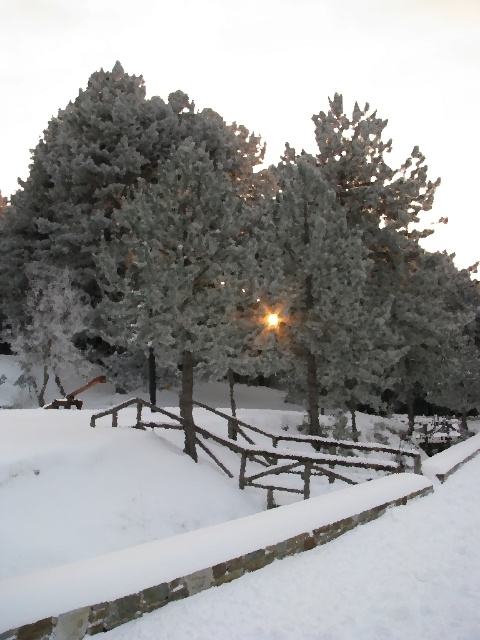
Question: Estimate the real-world distances between objects in this image. Which object is closer to the brown wooden fence at center?

Choices:
 (A) frosted snow-covered tree at upper left
 (B) white fluffy snow at center
 (C) frosted white tree at center

Answer: (B)

Question: Does white fluffy snow at center have a larger size compared to brown wooden fence at center?

Choices:
 (A) yes
 (B) no

Answer: (A)

Question: Which point is farther to the camera?

Choices:
 (A) brown wooden fence at center
 (B) frosted snow-covered tree at upper left
 (C) white fluffy snow at center
 (D) frosted white tree at center

Answer: (B)

Question: Which of the following is the farthest from the observer?

Choices:
 (A) (248, 483)
 (B) (129, 164)

Answer: (B)

Question: Does frosted snow-covered tree at upper left appear under brown wooden fence at center?

Choices:
 (A) yes
 (B) no

Answer: (B)

Question: Can you confirm if white fluffy snow at center is smaller than frosted white tree at center?

Choices:
 (A) no
 (B) yes

Answer: (B)